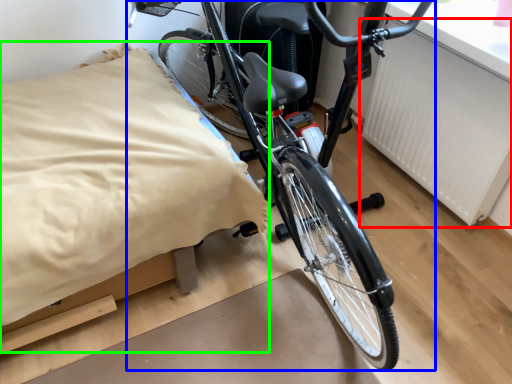
Question: Which object is the farthest from radiator (highlighted by a red box)? Choose among these: bicycle (highlighted by a blue box) or sheet (highlighted by a green box).

Choices:
 (A) bicycle
 (B) sheet

Answer: (B)